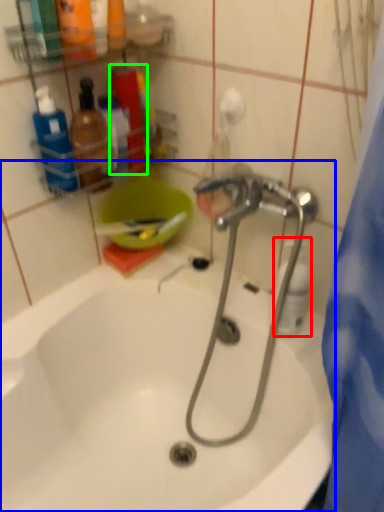
Question: Which object is the closest to the cleaning product (highlighted by a red box)? Choose among these: bathtub (highlighted by a blue box) or toiletry (highlighted by a green box).

Choices:
 (A) bathtub
 (B) toiletry

Answer: (A)